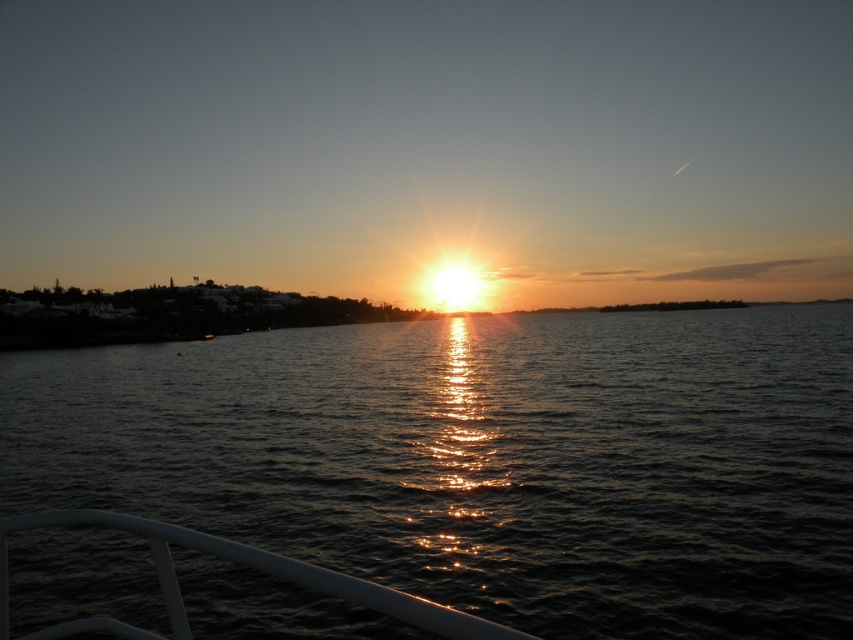
You are standing on the boat and want to take a photo of the sunset. There are two points marked in the scene, point (x=374, y=358) and point (x=192, y=531). Which point is closer to you?

Point (x=192, y=531) is closer to you because it is nearer than point (x=374, y=358), which is further away.

You are standing on a boat and see the glistening water at center and the white glossy rail at lower center. Which object is higher from your viewpoint?

The glistening water at center is above the white glossy rail at lower center, so the glistening water at center is higher from your viewpoint.